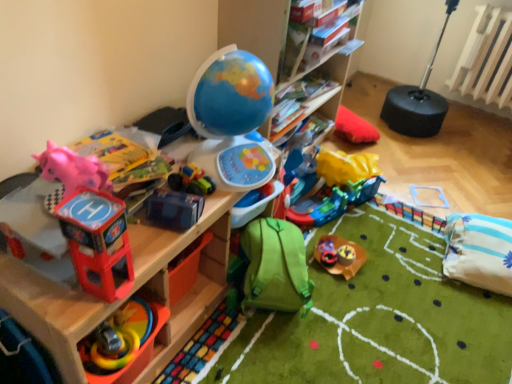
Find the location of `free space that is to the left of shiny metallic toy car at center, the 9th toy in the left-to-right sequence`. free space that is to the left of shiny metallic toy car at center, the 9th toy in the left-to-right sequence is located at coordinates (325, 254).